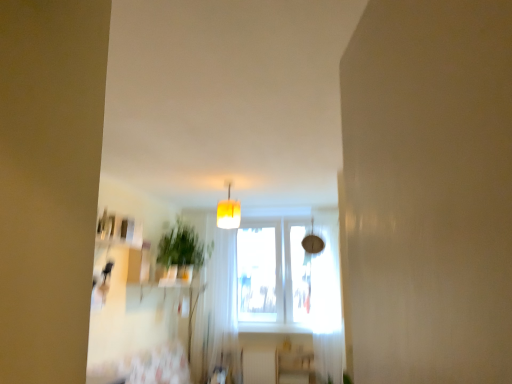
Question: Is white sheer curtain at right, which appears as the 2th curtain when viewed from the left, further to the viewer compared to green leafy plant at center?

Choices:
 (A) no
 (B) yes

Answer: (B)

Question: Would you say green leafy plant at center is part of white sheer curtain at right, which appears as the 1th curtain when viewed from the right,'s contents?

Choices:
 (A) no
 (B) yes

Answer: (A)

Question: Would you say white sheer curtain at right, which appears as the 1th curtain when viewed from the right, is outside green leafy plant at center?

Choices:
 (A) yes
 (B) no

Answer: (A)

Question: From the image's perspective, does white sheer curtain at right, which appears as the 2th curtain when viewed from the left, appear higher than green leafy plant at center?

Choices:
 (A) no
 (B) yes

Answer: (A)

Question: Can you confirm if white sheer curtain at right, which appears as the 1th curtain when viewed from the right, is thinner than green leafy plant at center?

Choices:
 (A) no
 (B) yes

Answer: (B)

Question: From the image's perspective, does white sheer curtain at right, which appears as the 2th curtain when viewed from the left, appear lower than green leafy plant at center?

Choices:
 (A) yes
 (B) no

Answer: (A)

Question: Is wooden shelf at lower center shorter than white sheer curtain at right, which appears as the 2th curtain when viewed from the left?

Choices:
 (A) yes
 (B) no

Answer: (A)

Question: Is wooden shelf at lower center further to camera compared to white sheer curtain at right, which appears as the 1th curtain when viewed from the right?

Choices:
 (A) yes
 (B) no

Answer: (A)

Question: From a real-world perspective, is wooden shelf at lower center positioned under white sheer curtain at right, which appears as the 1th curtain when viewed from the right, based on gravity?

Choices:
 (A) no
 (B) yes

Answer: (B)

Question: Does wooden shelf at lower center have a larger size compared to white sheer curtain at right, which appears as the 2th curtain when viewed from the left?

Choices:
 (A) no
 (B) yes

Answer: (A)

Question: Is there a large distance between wooden shelf at lower center and white sheer curtain at right, which appears as the 2th curtain when viewed from the left?

Choices:
 (A) no
 (B) yes

Answer: (A)

Question: Does wooden shelf at lower center appear on the right side of white sheer curtain at right, which appears as the 2th curtain when viewed from the left?

Choices:
 (A) no
 (B) yes

Answer: (A)

Question: Is yellow fabric lampshade at center at the right side of wooden shelf at lower center?

Choices:
 (A) no
 (B) yes

Answer: (A)